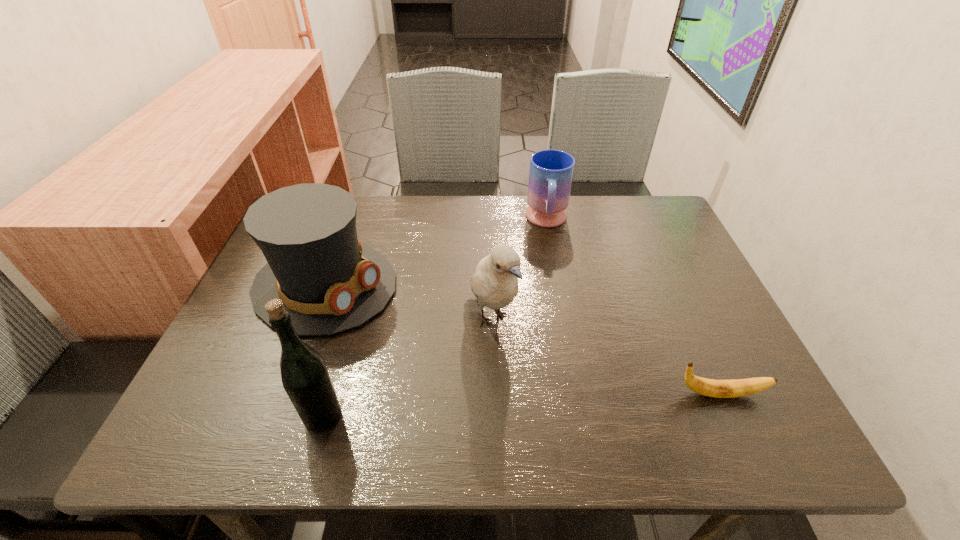
At what (x,y) coordinates should I click in order to perform the action: click on blank area located at the beak of the bird. Please return your answer as a coordinate pair (x, y). This screenshot has height=540, width=960. Looking at the image, I should click on (523, 382).

At what (x,y) coordinates should I click in order to perform the action: click on vacant space located at the beak of the bird. Please return your answer as a coordinate pair (x, y). Looking at the image, I should click on (536, 402).

Where is `free space located 0.080m at the beak of the bird`? The height and width of the screenshot is (540, 960). free space located 0.080m at the beak of the bird is located at coordinates (520, 379).

Where is `vacant space located on the side of the farthest object with the handle`? vacant space located on the side of the farthest object with the handle is located at coordinates (549, 303).

You are a GUI agent. You are given a task and a screenshot of the screen. Output one action in this format:
    pyautogui.click(x=<x>, y=<y>)
    Task: Click on the free space located 0.220m on the side of the farthest object with the handle
    
    Given the screenshot: What is the action you would take?
    pyautogui.click(x=549, y=297)

This screenshot has height=540, width=960. Find the location of `vacant area located 0.360m on the side of the farthest object with the handle`. vacant area located 0.360m on the side of the farthest object with the handle is located at coordinates (550, 342).

The width and height of the screenshot is (960, 540). I want to click on dress hat at the far edge, so click(330, 283).

This screenshot has height=540, width=960. In order to click on mug situated at the far edge in this screenshot , I will do `click(551, 172)`.

Where is `beer bottle at the near edge`? This screenshot has height=540, width=960. beer bottle at the near edge is located at coordinates (305, 378).

I want to click on banana located in the near edge section of the desktop, so click(x=708, y=387).